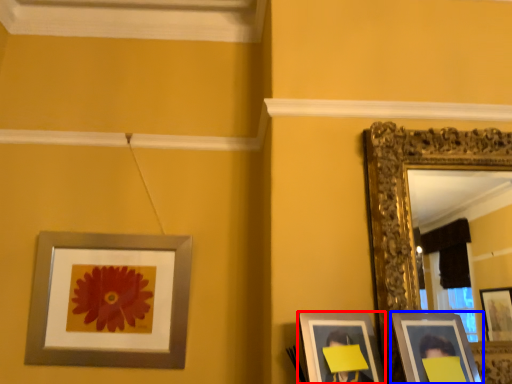
Question: Which object is further to the camera taking this photo, picture frame (highlighted by a red box) or picture frame (highlighted by a blue box)?

Choices:
 (A) picture frame
 (B) picture frame

Answer: (A)